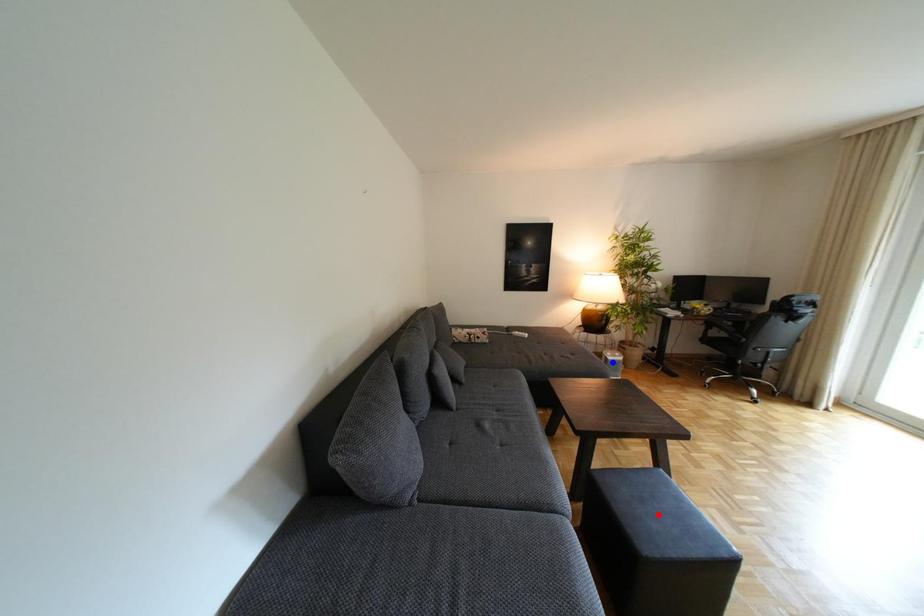
Question: In the image, two points are highlighted. Which point is nearer to the camera? Reply with the corresponding letter.

Choices:
 (A) blue point
 (B) red point

Answer: (B)